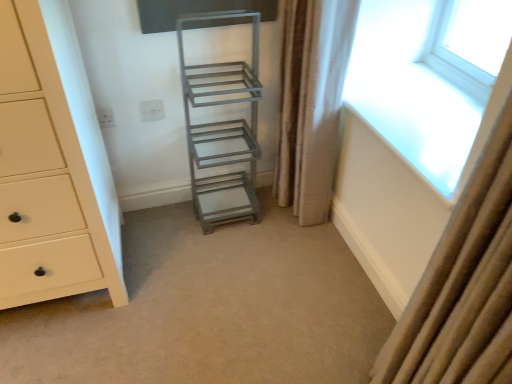
Identify the location of vacant area that lies between metallic gray shelf at center and matte cream chest of drawers at left. (177, 237).